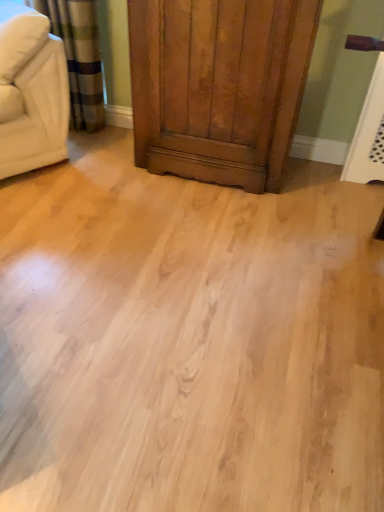
This screenshot has width=384, height=512. I want to click on free space in front of shiny brown wood dresser at center, so click(212, 226).